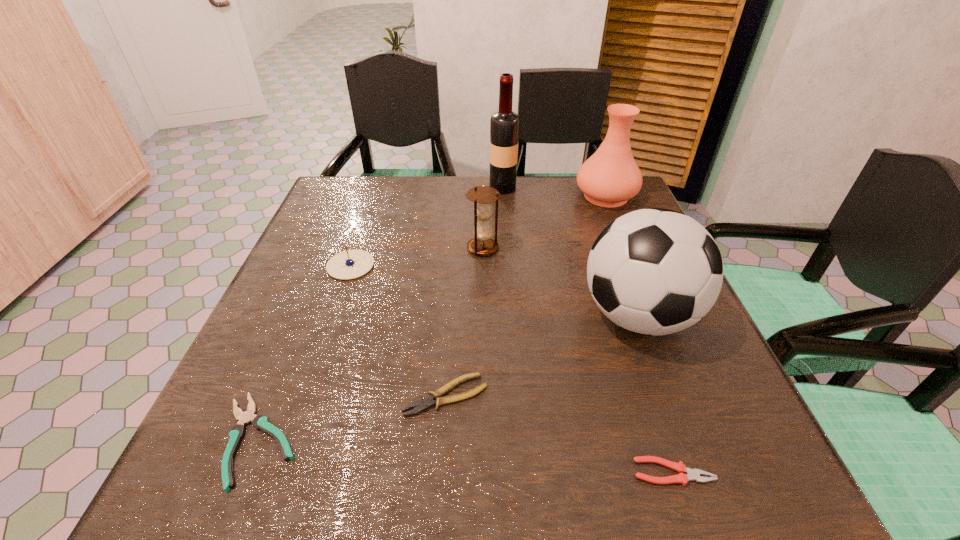
Identify which object is located as the seventh nearest to the compass. Please provide its 2D coordinates. Your answer should be formatted as a tuple, i.e. [(x, y)], where the tuple contains the x and y coordinates of a point satisfying the conditions above.

[(694, 474)]

Point out which object is positioned as the nearest to the leftmost pliers. Please provide its 2D coordinates. Your answer should be formatted as a tuple, i.e. [(x, y)], where the tuple contains the x and y coordinates of a point satisfying the conditions above.

[(423, 404)]

Identify which pliers is the second closest to the wine bottle. Please provide its 2D coordinates. Your answer should be formatted as a tuple, i.e. [(x, y)], where the tuple contains the x and y coordinates of a point satisfying the conditions above.

[(260, 422)]

Locate an element on the screen. pliers identified as the third closest to the fifth tallest object is located at coordinates (694, 474).

The image size is (960, 540). I want to click on vacant space that satisfies the following two spatial constraints: 1. on the back side of the vase; 2. on the left side of the leftmost pliers, so click(357, 196).